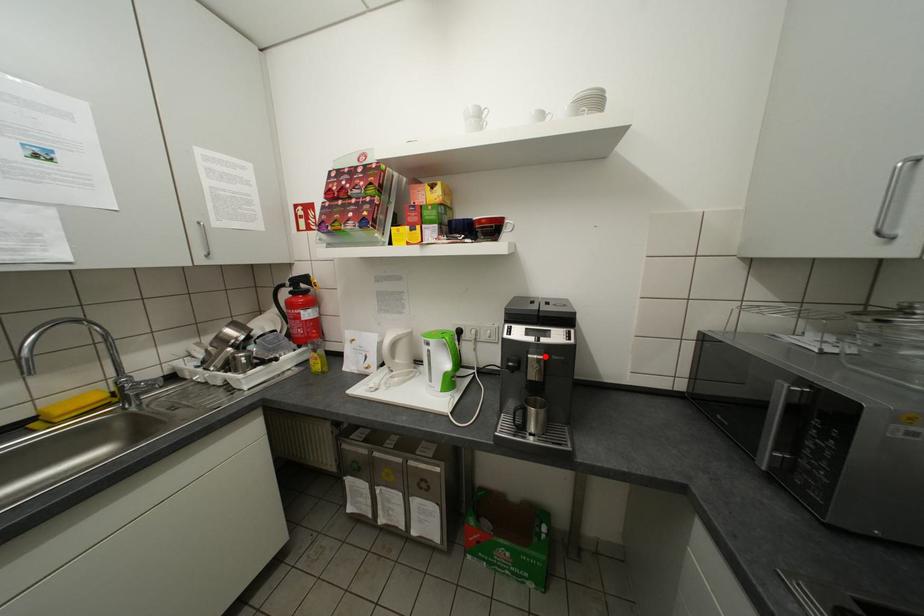
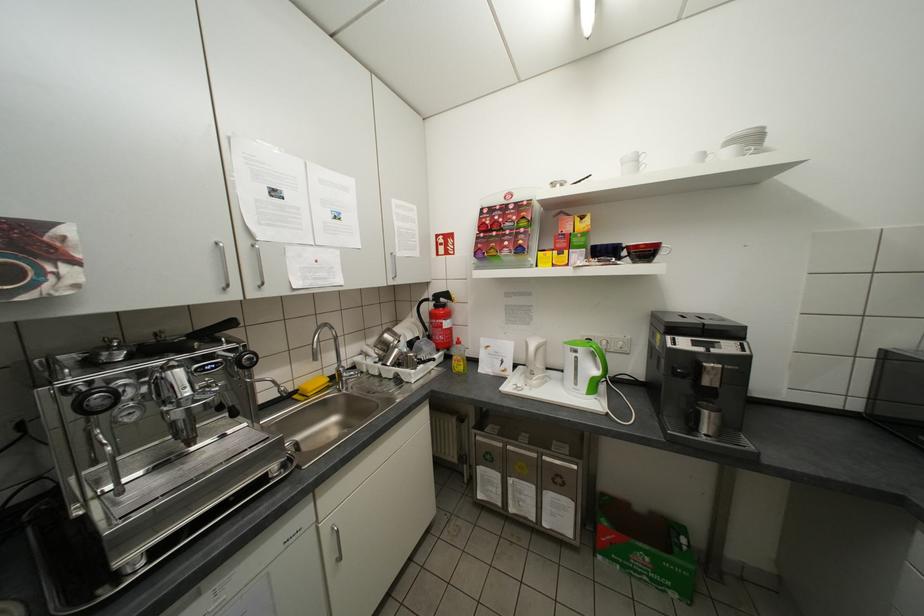
Where in the second image is the point corresponding to the highlighted location from the first image?

(721, 365)